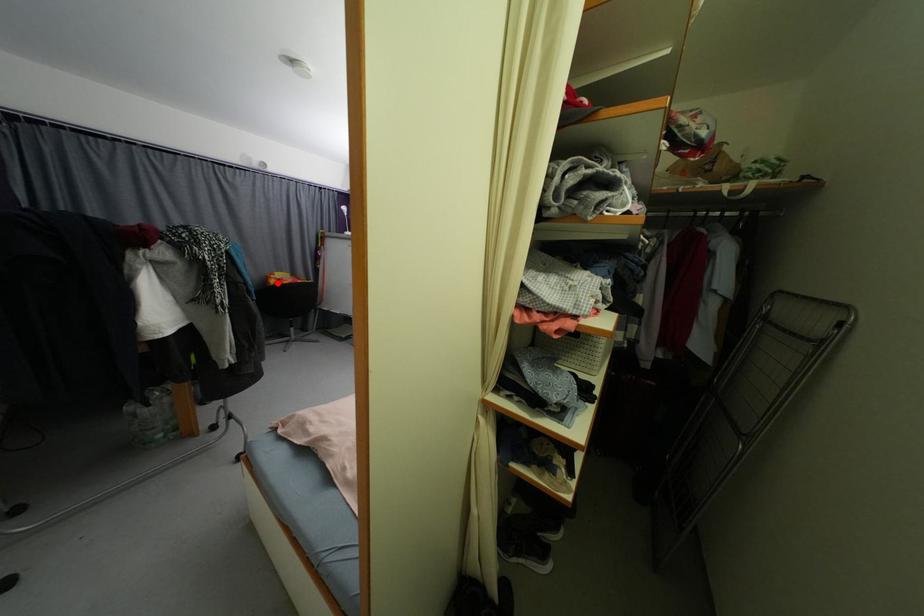
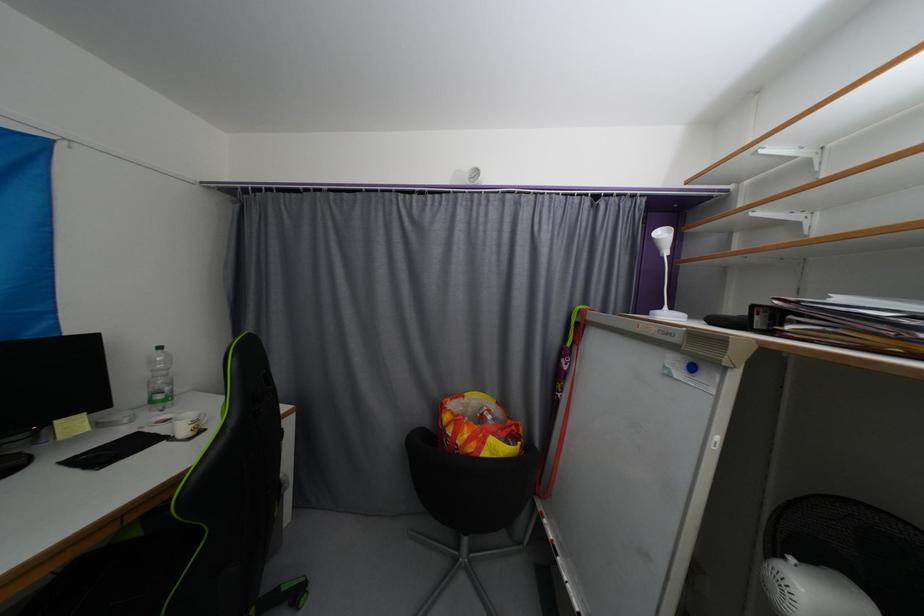
Find the pixel in the second image that matches the highlighted location in the first image.

(452, 419)